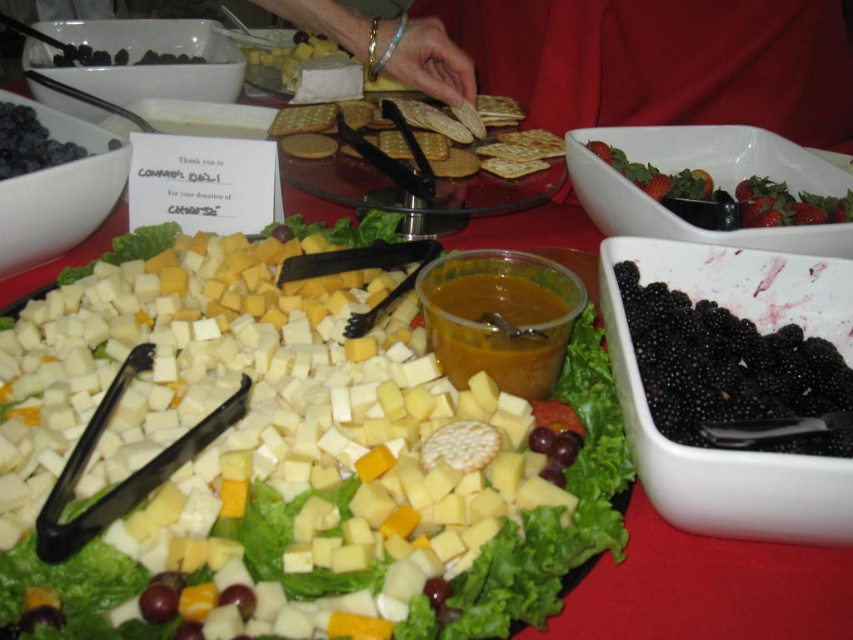
You are at a social gathering and want to grab a black glossy blackberry from the lower right corner of the cheese platter. The point you need to reach is marked as point (730, 371). Is this point on the black glossy blackberry at lower right?

Yes, the point (730, 371) is on the black glossy blackberry at lower right.